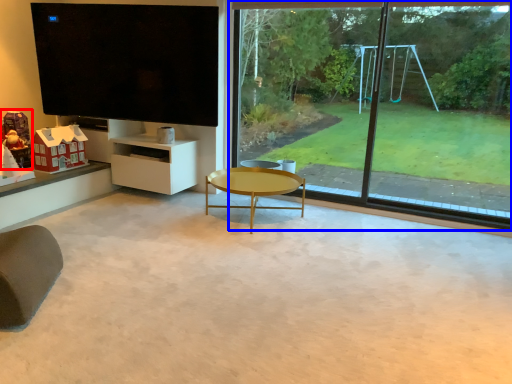
Question: Which object appears farthest to the camera in this image, toy (highlighted by a red box) or window (highlighted by a blue box)?

Choices:
 (A) toy
 (B) window

Answer: (A)